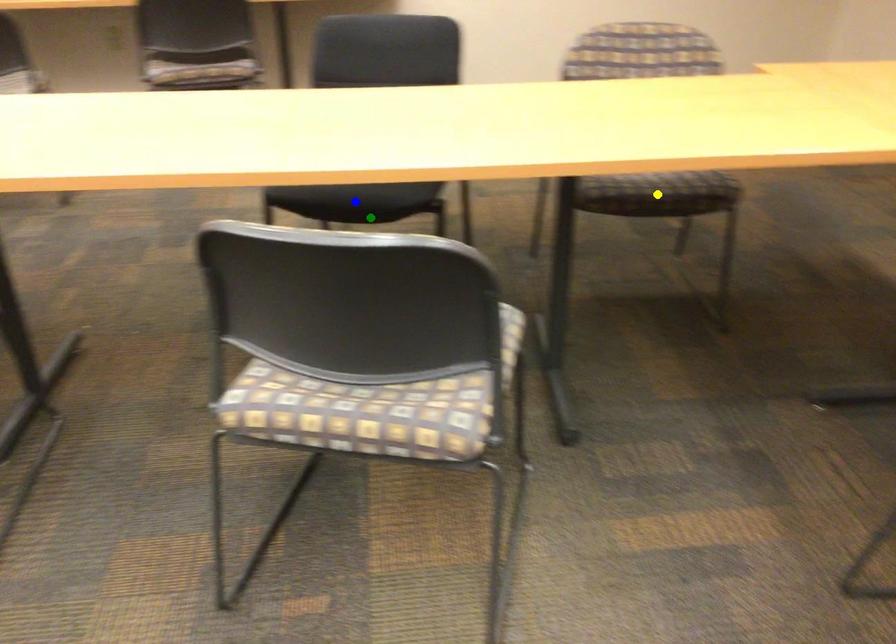
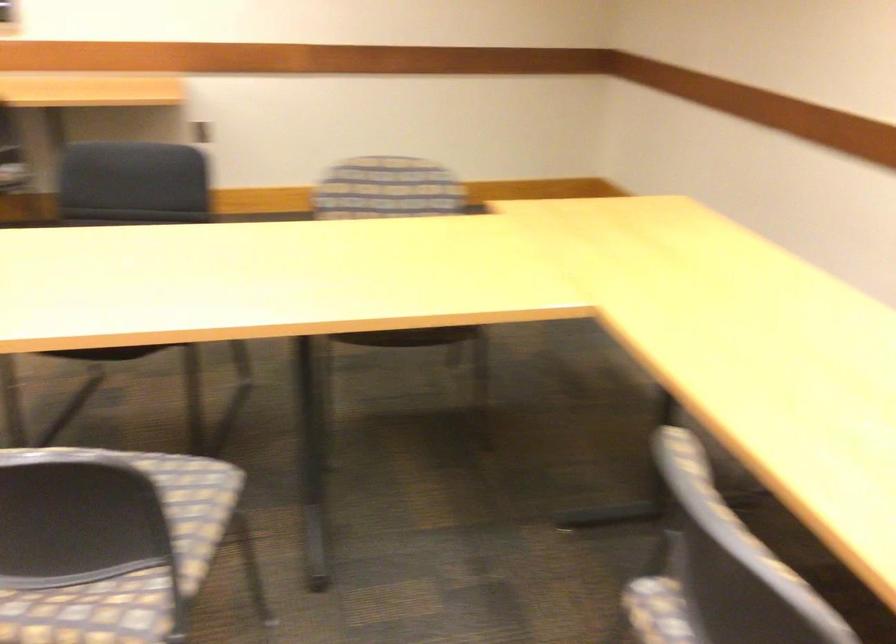
I am providing you with two images of the same scene from different viewpoints. Three points are marked in image1. Which point corresponds to a part or object that is occluded in image2?In image1, three points are marked. Which of them correspond to a part or object that is occluded in image2?Among the three points shown in image1, which one corresponds to a part or object that is no longer visible due to occlusion in image2?

Invisible in image2: blue point, yellow point.